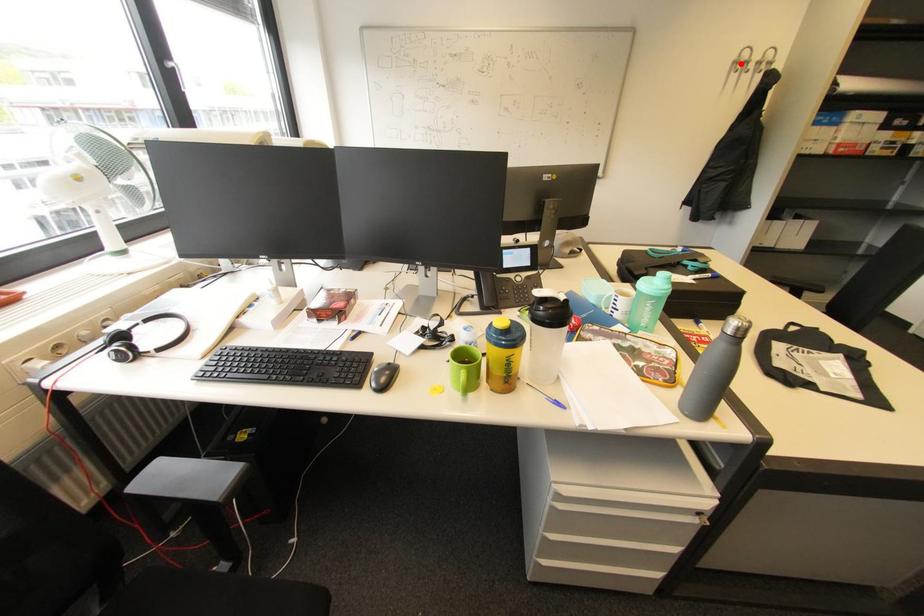
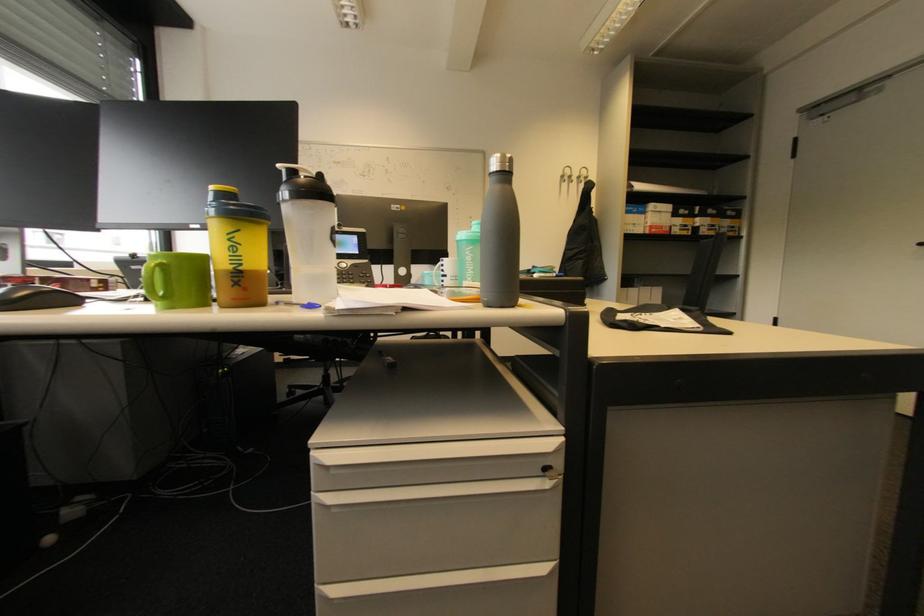
Question: A red point is marked in image1. In image2, is the corresponding 3D point closer to the camera or farther? Reply with the corresponding letter.

Choices:
 (A) The corresponding 3D point is closer.
 (B) The corresponding 3D point is farther.

Answer: (A)